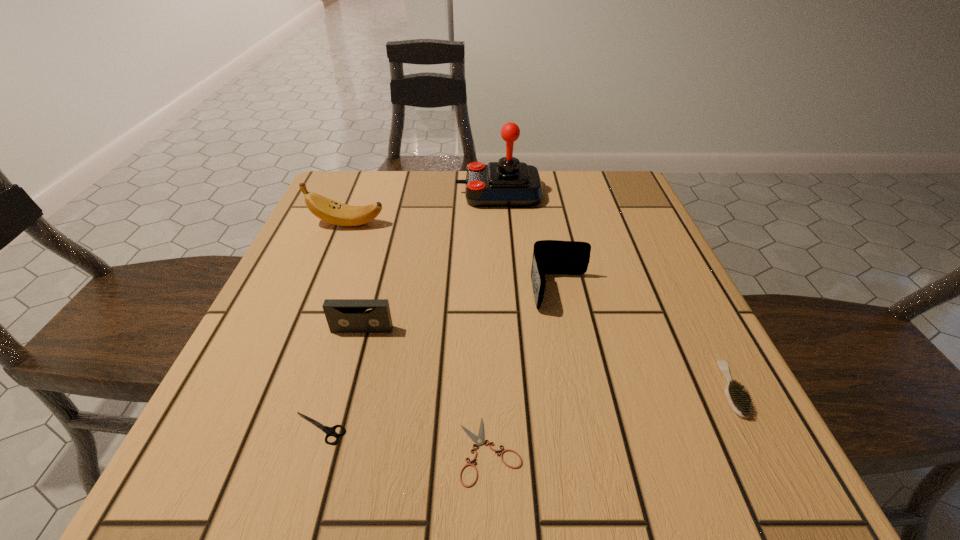
The width and height of the screenshot is (960, 540). In order to click on free space located 0.140m on the left of the rightmost object in this screenshot , I will do `click(628, 389)`.

Identify the location of vacant position located 0.190m on the back of the left shears. (352, 318).

In order to click on free space located on the right of the shorter shears in this screenshot , I will do `click(581, 450)`.

The width and height of the screenshot is (960, 540). I want to click on joystick located in the far edge section of the desktop, so click(x=507, y=183).

This screenshot has height=540, width=960. Identify the location of banana that is positioned at the far edge. (328, 210).

Identify the location of banana at the left edge. (328, 210).

Image resolution: width=960 pixels, height=540 pixels. I want to click on videotape at the left edge, so click(x=343, y=315).

Locate an element on the screen. This screenshot has height=540, width=960. shears positioned at the left edge is located at coordinates point(330,431).

I want to click on object present at the right edge, so click(x=738, y=398).

Image resolution: width=960 pixels, height=540 pixels. I want to click on object positioned at the far left corner, so click(x=328, y=210).